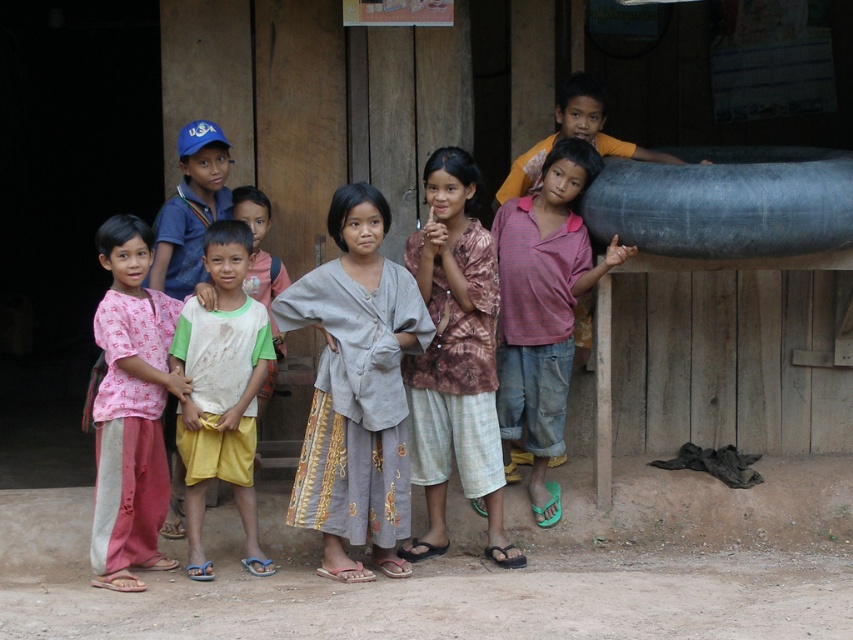
You are a photographer standing at a distance and want to take a closeup photo of the gray fabric shirt at center. Considering the distance between you and the shirt, can you estimate whether you need to use a zoom lens to capture the shirt clearly?

The gray fabric shirt at center is 6.77 meters away from the viewer. To capture it clearly in a closeup, a zoom lens would be necessary to bridge this distance.